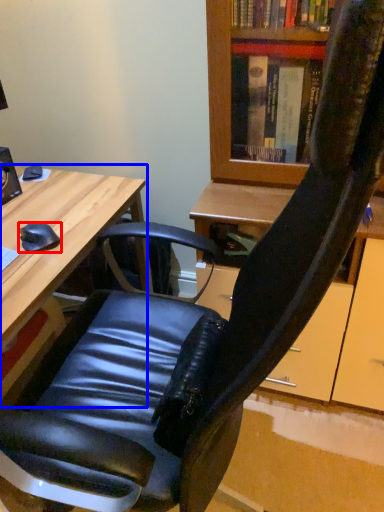
Question: Which point is closer to the camera, mouse (highlighted by a red box) or desk (highlighted by a blue box)?

Choices:
 (A) mouse
 (B) desk

Answer: (B)